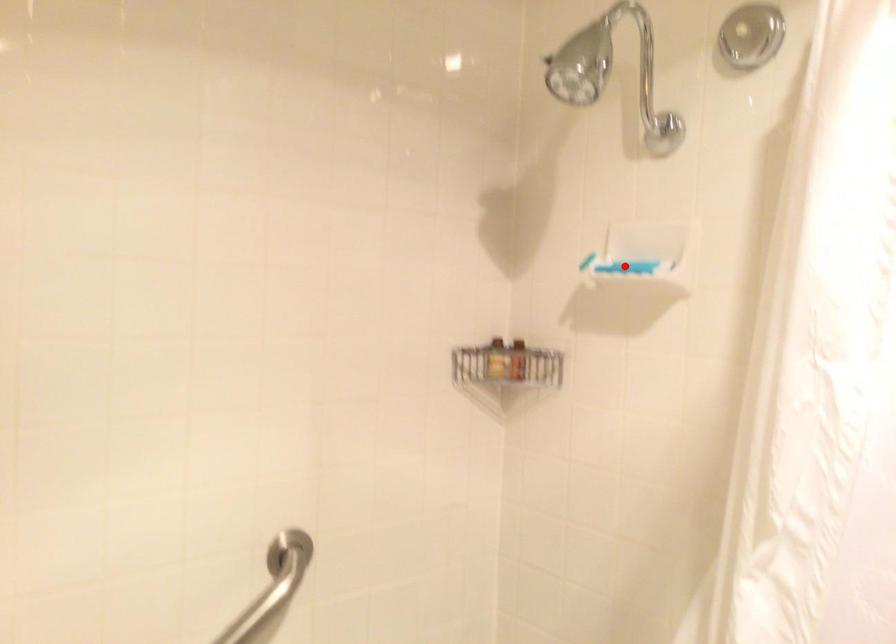
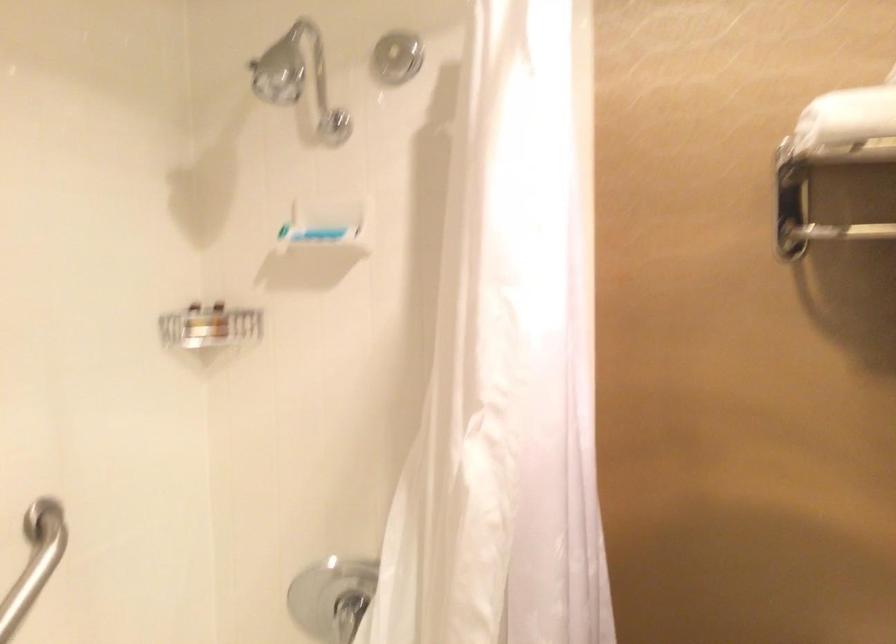
The point at the highlighted location is marked in the first image. Where is the corresponding point in the second image?

(316, 234)